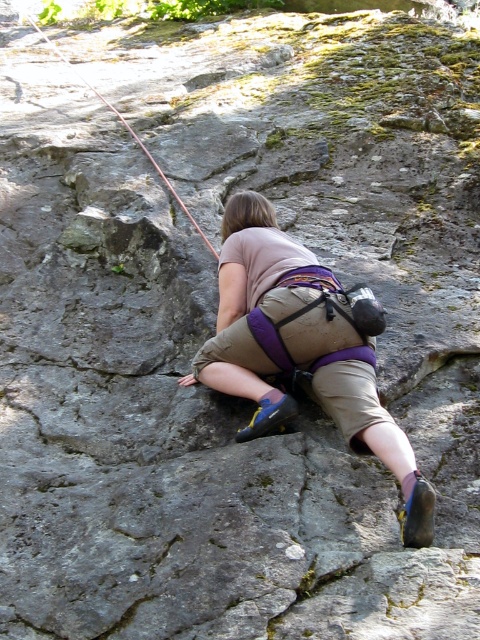
Question: Does khaki cotton shorts at center come in front of red nylon rope at upper center?

Choices:
 (A) no
 (B) yes

Answer: (B)

Question: Which point appears farthest from the camera in this image?

Choices:
 (A) (257, 284)
 (B) (140, 140)

Answer: (B)

Question: In this image, where is khaki cotton shorts at center located relative to red nylon rope at upper center?

Choices:
 (A) right
 (B) left

Answer: (A)

Question: Is khaki cotton shorts at center smaller than red nylon rope at upper center?

Choices:
 (A) yes
 (B) no

Answer: (A)

Question: Which object appears closest to the camera in this image?

Choices:
 (A) red nylon rope at upper center
 (B) khaki cotton shorts at center

Answer: (B)